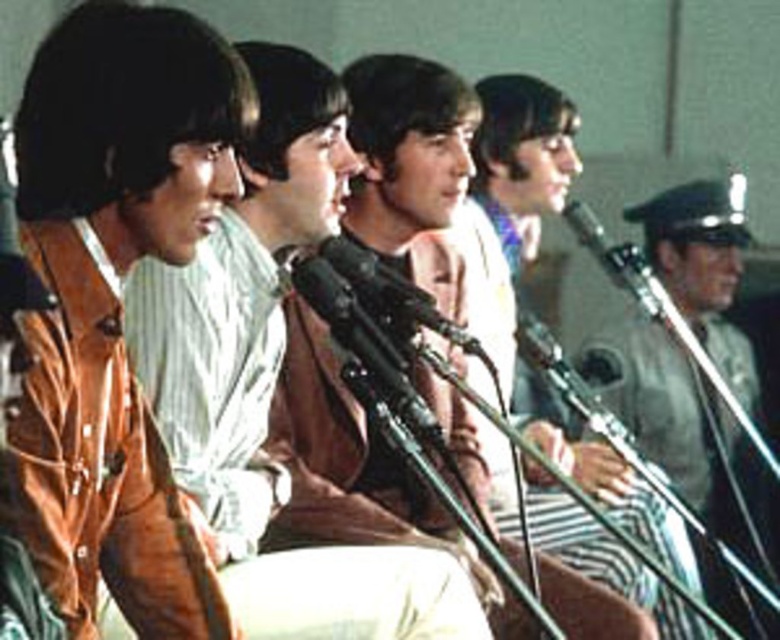
Question: Which point appears closest to the camera in this image?

Choices:
 (A) (392, 324)
 (B) (601, 257)
 (C) (745, 339)

Answer: (A)

Question: Does gray uniform at right have a smaller size compared to metallic silver microphone at center?

Choices:
 (A) no
 (B) yes

Answer: (A)

Question: Which point is farther to the camera?

Choices:
 (A) (736, 196)
 (B) (341, 252)

Answer: (A)

Question: Is black metallic microphone at center to the right of metallic silver microphone at center from the viewer's perspective?

Choices:
 (A) no
 (B) yes

Answer: (A)

Question: Which object is farther from the camera taking this photo?

Choices:
 (A) gray uniform at right
 (B) black metallic microphone at center

Answer: (A)

Question: Is the position of gray uniform at right less distant than that of black metallic microphone at center?

Choices:
 (A) no
 (B) yes

Answer: (A)